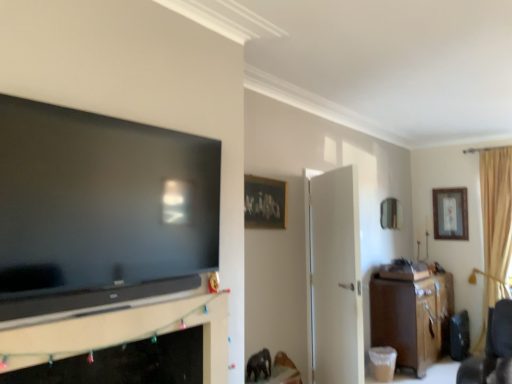
You are a GUI agent. You are given a task and a screenshot of the screen. Output one action in this format:
    pyautogui.click(x=<x>, y=<y>)
    Task: Click on the black matte fireplace at lower left
    The height and width of the screenshot is (384, 512).
    Given the screenshot: What is the action you would take?
    pyautogui.click(x=125, y=364)

What do you see at coordinates (335, 278) in the screenshot? I see `white matte door at center` at bounding box center [335, 278].

Find the location of a particular element. metallic mirror at upper right, which is the second picture frame in left-to-right order is located at coordinates (391, 214).

Where is `wooden framed artwork at upper center, which appears as the 3th picture frame when viewed from the back`? wooden framed artwork at upper center, which appears as the 3th picture frame when viewed from the back is located at coordinates (264, 203).

Can you confirm if beige fabric curtain at right is smaller than wooden framed artwork at upper center, placed as the first picture frame when sorted from left to right?

Actually, beige fabric curtain at right might be larger than wooden framed artwork at upper center, placed as the first picture frame when sorted from left to right.

Based on their positions, is beige fabric curtain at right located to the left or right of wooden framed artwork at upper center, placed as the first picture frame when sorted from left to right?

Clearly, beige fabric curtain at right is on the right of wooden framed artwork at upper center, placed as the first picture frame when sorted from left to right, in the image.

Can you tell me how much beige fabric curtain at right and wooden framed artwork at upper center, placed as the first picture frame when sorted from left to right, differ in facing direction?

91.1 degrees.

Which object is further away from the camera taking this photo, beige fabric curtain at right or wooden framed artwork at upper center, which appears as the 3th picture frame when viewed from the back?

beige fabric curtain at right is further from the camera.

Which is more to the left, wooden framed picture at upper right, arranged as the 3th picture frame when viewed from the left, or brown wood cabinet at right?

From the viewer's perspective, brown wood cabinet at right appears more on the left side.

From the image's perspective, is wooden framed picture at upper right, arranged as the 3th picture frame when viewed from the left, below brown wood cabinet at right?

Incorrect, from the image's perspective, wooden framed picture at upper right, arranged as the 3th picture frame when viewed from the left, is higher than brown wood cabinet at right.

Which of these two, wooden framed picture at upper right, arranged as the 3th picture frame when viewed from the left, or brown wood cabinet at right, is smaller?

With smaller size is wooden framed picture at upper right, arranged as the 3th picture frame when viewed from the left.

How much distance is there between wooden framed picture at upper right, which ranks as the third picture frame in front-to-back order, and brown wood cabinet at right?

wooden framed picture at upper right, which ranks as the third picture frame in front-to-back order, and brown wood cabinet at right are 1.56 meters apart from each other.

Which of these two, wooden framed artwork at upper center, marked as the first picture frame in a front-to-back arrangement, or matte black tv at left, stands shorter?

With less height is wooden framed artwork at upper center, marked as the first picture frame in a front-to-back arrangement.

Between wooden framed artwork at upper center, marked as the first picture frame in a front-to-back arrangement, and matte black tv at left, which one has larger size?

matte black tv at left is bigger.

Between wooden framed artwork at upper center, placed as the first picture frame when sorted from left to right, and matte black tv at left, which one is positioned in front?

Positioned in front is matte black tv at left.

From a real-world perspective, is wooden framed artwork at upper center, which appears as the 3th picture frame when viewed from the back, located beneath matte black tv at left?

Actually, wooden framed artwork at upper center, which appears as the 3th picture frame when viewed from the back, is physically above matte black tv at left in the real world.

In the image, is white matte door at center positioned in front of or behind beige fabric curtain at right?

Visually, white matte door at center is located in front of beige fabric curtain at right.

Considering the sizes of objects white matte door at center and beige fabric curtain at right in the image provided, who is wider, white matte door at center or beige fabric curtain at right?

With larger width is beige fabric curtain at right.

From a real-world perspective, does white matte door at center stand above beige fabric curtain at right?

No, from a real-world perspective, white matte door at center is not above beige fabric curtain at right.

Is white matte door at center not near beige fabric curtain at right?

That's right, there is a large distance between white matte door at center and beige fabric curtain at right.

Is point (246, 184) in front of point (151, 350)?

No, (246, 184) is further to viewer.

Consider the image. Between wooden framed artwork at upper center, marked as the first picture frame in a front-to-back arrangement, and black matte fireplace at lower left, which one has more height?

black matte fireplace at lower left is taller.

Is wooden framed artwork at upper center, the third picture frame viewed from the right, outside of black matte fireplace at lower left?

That's correct, wooden framed artwork at upper center, the third picture frame viewed from the right, is outside of black matte fireplace at lower left.

Is black matte fireplace at lower left at the back of wooden framed artwork at upper center, which appears as the 3th picture frame when viewed from the back?

No, wooden framed artwork at upper center, which appears as the 3th picture frame when viewed from the back, is not facing away from black matte fireplace at lower left.

Is wooden framed artwork at upper center, which appears as the 3th picture frame when viewed from the back, surrounding brown wood cabinet at right?

Actually, brown wood cabinet at right is outside wooden framed artwork at upper center, which appears as the 3th picture frame when viewed from the back.

From the image's perspective, between wooden framed artwork at upper center, placed as the first picture frame when sorted from left to right, and brown wood cabinet at right, which one is located above?

wooden framed artwork at upper center, placed as the first picture frame when sorted from left to right, appears higher in the image.

Who is smaller, wooden framed artwork at upper center, the third picture frame viewed from the right, or brown wood cabinet at right?

Smaller between the two is wooden framed artwork at upper center, the third picture frame viewed from the right.

Based on their sizes in the image, would you say white matte door at center is bigger or smaller than wooden framed picture at upper right, acting as the 1th picture frame starting from the back?

white matte door at center is bigger than wooden framed picture at upper right, acting as the 1th picture frame starting from the back.

Is wooden framed picture at upper right, arranged as the 3th picture frame when viewed from the left, surrounded by white matte door at center?

No, wooden framed picture at upper right, arranged as the 3th picture frame when viewed from the left, is located outside of white matte door at center.

Between point (345, 243) and point (446, 196), which one is positioned behind?

The point (446, 196) is farther from the camera.

From a real-world perspective, who is located lower, white matte door at center or wooden framed picture at upper right, which ranks as the third picture frame in front-to-back order?

white matte door at center is physically lower.

The height and width of the screenshot is (384, 512). What are the coordinates of `the 3rd picture frame to the left when counting from the beige fabric curtain at right` in the screenshot? It's located at (264, 203).

You are a GUI agent. You are given a task and a screenshot of the screen. Output one action in this format:
    pyautogui.click(x=<x>, y=<y>)
    Task: Click on the 1st picture frame above when counting from the brown wood cabinet at right (from the image's perspective)
    The height and width of the screenshot is (384, 512).
    Given the screenshot: What is the action you would take?
    pyautogui.click(x=450, y=213)

Looking at the image, which one is located further to matte black tv at left, black matte fireplace at lower left or wooden framed picture at upper right, arranged as the 3th picture frame when viewed from the left?

wooden framed picture at upper right, arranged as the 3th picture frame when viewed from the left, is further to matte black tv at left.

Based on their spatial positions, is wooden framed artwork at upper center, the third picture frame viewed from the right, or wooden framed picture at upper right, the first picture frame from the right, further from beige fabric curtain at right?

wooden framed artwork at upper center, the third picture frame viewed from the right, is further to beige fabric curtain at right.

Estimate the real-world distances between objects in this image. Which object is closer to white matte door at center, wooden framed artwork at upper center, placed as the first picture frame when sorted from left to right, or beige fabric curtain at right?

Among the two, wooden framed artwork at upper center, placed as the first picture frame when sorted from left to right, is located nearer to white matte door at center.

Based on their spatial positions, is brown wood cabinet at right or metallic mirror at upper right, which is the second picture frame in left-to-right order, closer to wooden framed artwork at upper center, placed as the first picture frame when sorted from left to right?

brown wood cabinet at right.

Looking at the image, which one is located closer to metallic mirror at upper right, which is the 2th picture frame from back to front, brown wood cabinet at right or matte black tv at left?

brown wood cabinet at right.

Based on their spatial positions, is black matte fireplace at lower left or brown wood cabinet at right closer to white matte door at center?

brown wood cabinet at right is positioned closer to the anchor white matte door at center.

From the picture: From the image, which object appears to be farther from white matte door at center, matte black tv at left or brown wood cabinet at right?

The object further to white matte door at center is matte black tv at left.

Looking at the image, which one is located further to metallic mirror at upper right, which is the second picture frame in left-to-right order, beige fabric curtain at right or white matte door at center?

white matte door at center lies further to metallic mirror at upper right, which is the second picture frame in left-to-right order, than the other object.

At what (x,y) coordinates should I click in order to perform the action: click on door between matte black tv at left and wooden framed artwork at upper center, the third picture frame viewed from the right, in the front-back direction. Please return your answer as a coordinate pair (x, y). This screenshot has width=512, height=384. Looking at the image, I should click on 335,278.

Where is `curtain between brown wood cabinet at right and wooden framed picture at upper right, acting as the 1th picture frame starting from the back, along the z-axis`? The image size is (512, 384). curtain between brown wood cabinet at right and wooden framed picture at upper right, acting as the 1th picture frame starting from the back, along the z-axis is located at coordinates (495, 228).

You are a GUI agent. You are given a task and a screenshot of the screen. Output one action in this format:
    pyautogui.click(x=<x>, y=<y>)
    Task: Click on the cabinetry located between matte black tv at left and beige fabric curtain at right in the depth direction
    The image size is (512, 384).
    Given the screenshot: What is the action you would take?
    pyautogui.click(x=412, y=318)

Locate an element on the screen. The image size is (512, 384). curtain between white matte door at center and metallic mirror at upper right, which is the second picture frame in left-to-right order, in the front-back direction is located at coordinates (495, 228).